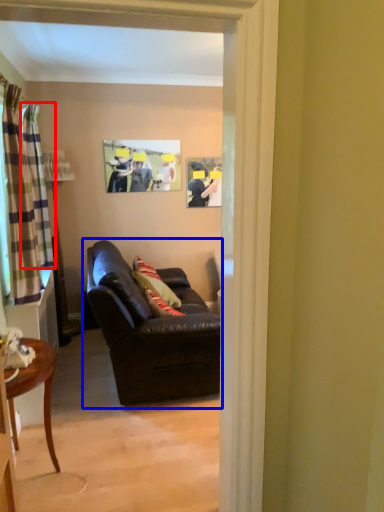
Question: Among these objects, which one is farthest to the camera, curtain (highlighted by a red box) or studio couch (highlighted by a blue box)?

Choices:
 (A) curtain
 (B) studio couch

Answer: (A)